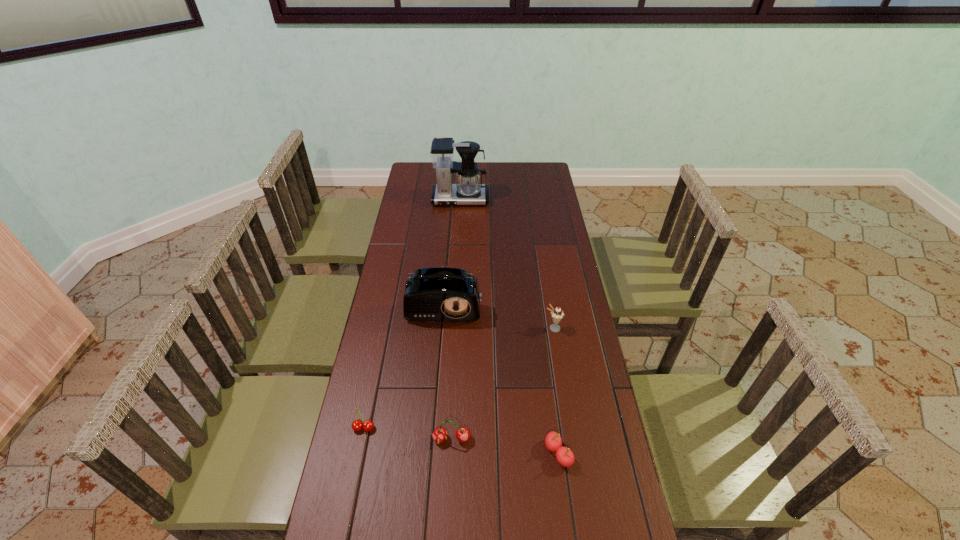
Identify the location of the tallest object. The image size is (960, 540). [468, 190].

What are the coordinates of `coffee maker` in the screenshot? It's located at (468, 190).

Image resolution: width=960 pixels, height=540 pixels. I want to click on radio receiver, so click(437, 294).

I want to click on the fourth shortest object, so click(557, 314).

The height and width of the screenshot is (540, 960). Find the location of `the tallest cherry`. the tallest cherry is located at coordinates (440, 434).

The height and width of the screenshot is (540, 960). I want to click on the second cherry from left to right, so click(440, 434).

What are the coordinates of `the leftmost object` in the screenshot? It's located at (357, 425).

Identify the location of the rightmost cherry. (553, 441).

You are a GUI agent. You are given a task and a screenshot of the screen. Output one action in this format:
    pyautogui.click(x=<x>, y=<y>)
    Task: Click on the vacant space located at the front of the coffee maker where the controls are located
    The height and width of the screenshot is (540, 960).
    Given the screenshot: What is the action you would take?
    pyautogui.click(x=457, y=257)

Locate an element on the screen. The width and height of the screenshot is (960, 540). free location located 0.110m on the front-facing side of the fifth shortest object is located at coordinates (441, 350).